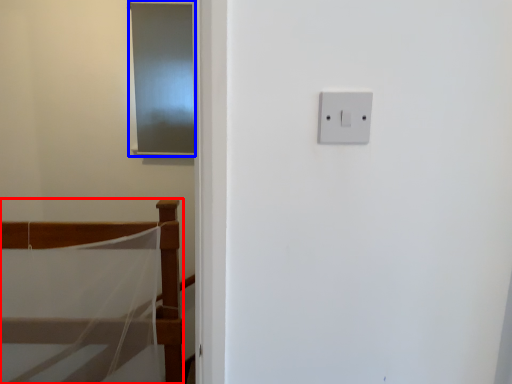
Question: Which of the following is the farthest to the observer, furniture (highlighted by a red box) or screen door (highlighted by a blue box)?

Choices:
 (A) furniture
 (B) screen door

Answer: (B)